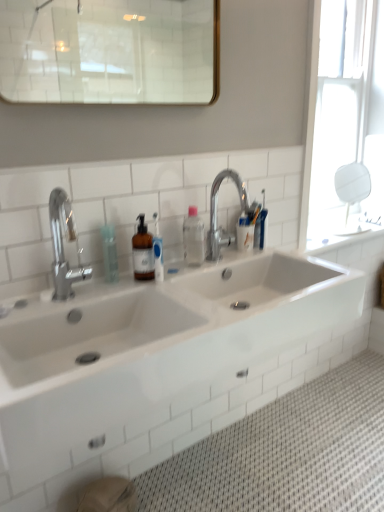
Locate an element on the screen. vacant area to the right of polished chrome faucet at left, the 1th tap when ordered from left to right is located at coordinates (145, 290).